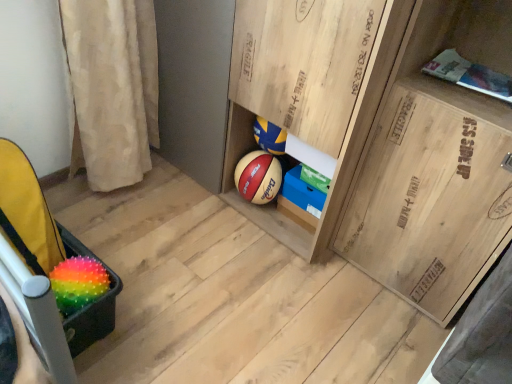
Question: Is blue cardboard box at center, which is the 2th cabinetry in right-to-left order, far away from wooden cabinet at center, placed as the third cabinetry when sorted from right to left?

Choices:
 (A) no
 (B) yes

Answer: (A)

Question: From the image's perspective, would you say blue cardboard box at center, which is the 2th cabinetry in right-to-left order, is shown under wooden cabinet at center, placed as the third cabinetry when sorted from right to left?

Choices:
 (A) no
 (B) yes

Answer: (B)

Question: Is blue cardboard box at center, acting as the second cabinetry starting from the left, positioned with its back to wooden cabinet at center, placed as the third cabinetry when sorted from right to left?

Choices:
 (A) yes
 (B) no

Answer: (A)

Question: Is blue cardboard box at center, acting as the second cabinetry starting from the left, in front of wooden cabinet at center, the 1th cabinetry viewed from the left?

Choices:
 (A) no
 (B) yes

Answer: (A)

Question: Does blue cardboard box at center, acting as the second cabinetry starting from the left, have a smaller size compared to wooden cabinet at center, placed as the third cabinetry when sorted from right to left?

Choices:
 (A) yes
 (B) no

Answer: (A)

Question: Which is correct: wooden cabinet at center, placed as the third cabinetry when sorted from right to left, is inside rainbow spiky ball at lower left, or outside of it?

Choices:
 (A) inside
 (B) outside

Answer: (B)

Question: From the image's perspective, is wooden cabinet at center, the 1th cabinetry viewed from the left, above or below rainbow spiky ball at lower left?

Choices:
 (A) above
 (B) below

Answer: (A)

Question: Is point (317, 162) positioned closer to the camera than point (94, 274)?

Choices:
 (A) closer
 (B) farther

Answer: (B)

Question: From a real-world perspective, relative to rainbow spiky ball at lower left, is wooden cabinet at center, the 1th cabinetry viewed from the left, vertically above or below?

Choices:
 (A) above
 (B) below

Answer: (A)

Question: Is wooden crate at right, which appears as the first cabinetry when viewed from the right, bigger or smaller than rainbow spiky ball at lower left?

Choices:
 (A) small
 (B) big

Answer: (B)

Question: From a real-world perspective, is wooden crate at right, which appears as the first cabinetry when viewed from the right, positioned above or below rainbow spiky ball at lower left?

Choices:
 (A) below
 (B) above

Answer: (B)

Question: Considering the positions of wooden crate at right, which appears as the first cabinetry when viewed from the right, and rainbow spiky ball at lower left in the image, is wooden crate at right, which appears as the first cabinetry when viewed from the right, taller or shorter than rainbow spiky ball at lower left?

Choices:
 (A) tall
 (B) short

Answer: (A)

Question: Relative to rainbow spiky ball at lower left, is wooden crate at right, which appears as the first cabinetry when viewed from the right, in front or behind?

Choices:
 (A) behind
 (B) front

Answer: (B)

Question: Does point (17, 145) appear closer or farther from the camera than point (321, 203)?

Choices:
 (A) farther
 (B) closer

Answer: (B)

Question: From a real-world perspective, relative to blue cardboard box at center, which is the 2th cabinetry in right-to-left order, is rainbow spiky ball at lower left vertically above or below?

Choices:
 (A) below
 (B) above

Answer: (A)